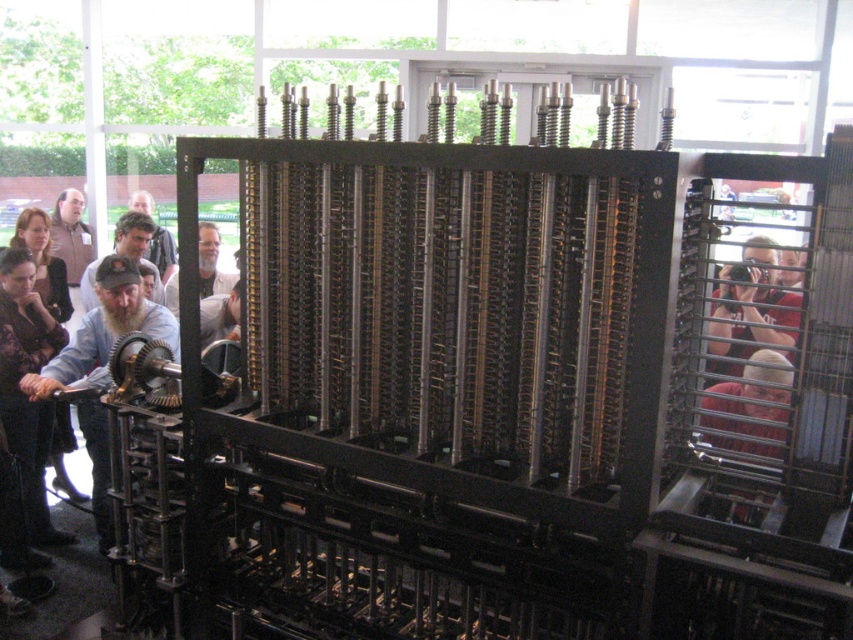
Between dark brown leather jacket at left and light brown leather jacket at left, which one is positioned lower?

Positioned lower is dark brown leather jacket at left.

Does dark brown leather jacket at left appear under light brown leather jacket at left?

Indeed, dark brown leather jacket at left is positioned under light brown leather jacket at left.

The image size is (853, 640). I want to click on dark brown leather jacket at left, so click(22, 390).

Does matte black camera at right appear on the left side of light brown leather jacket at left?

In fact, matte black camera at right is to the right of light brown leather jacket at left.

Identify the location of matte black camera at right. The image size is (853, 640). (751, 308).

Who is positioned more to the left, light brown leather jacket at left or light brown hair at center?

From the viewer's perspective, light brown leather jacket at left appears more on the left side.

Is light brown leather jacket at left wider than light brown hair at center?

Incorrect, light brown leather jacket at left's width does not surpass light brown hair at center's.

Is point (64, 224) positioned before point (164, 269)?

No, it is not.

The image size is (853, 640). Identify the location of light brown leather jacket at left. (71, 234).